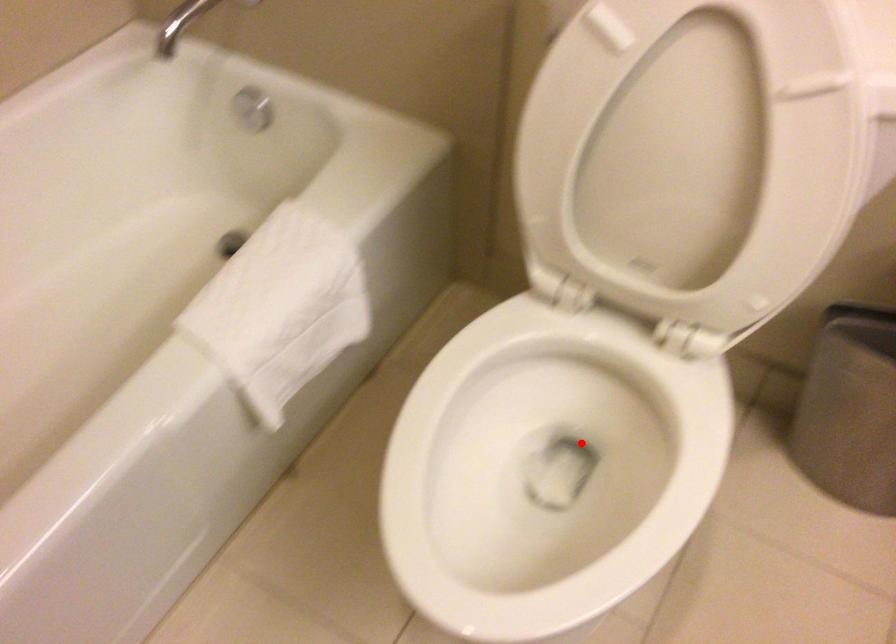
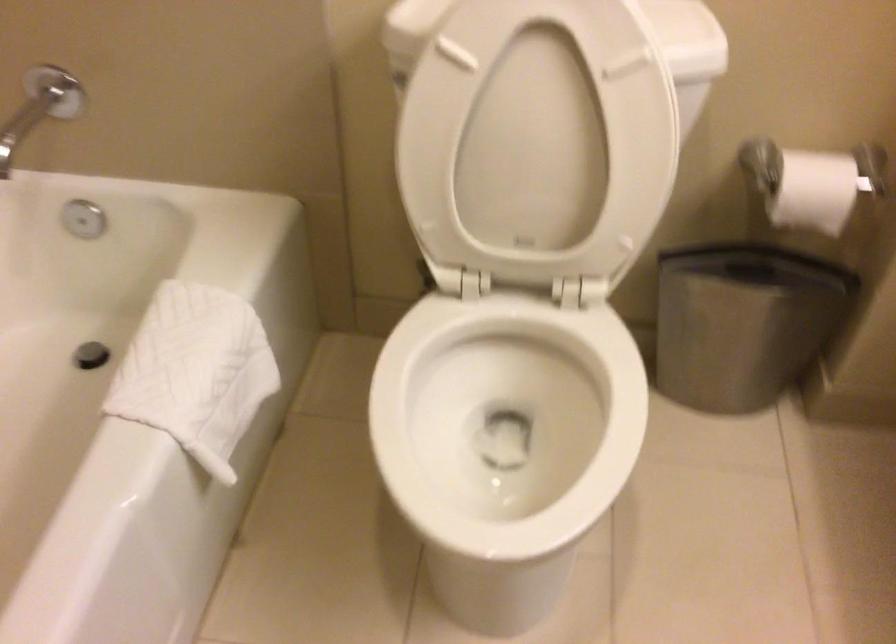
Question: I am providing you with two images of the same scene from different viewpoints. A red point is shown in image1. For the corresponding object point in image2, is it positioned nearer or farther from the camera?

Choices:
 (A) Nearer
 (B) Farther

Answer: (B)